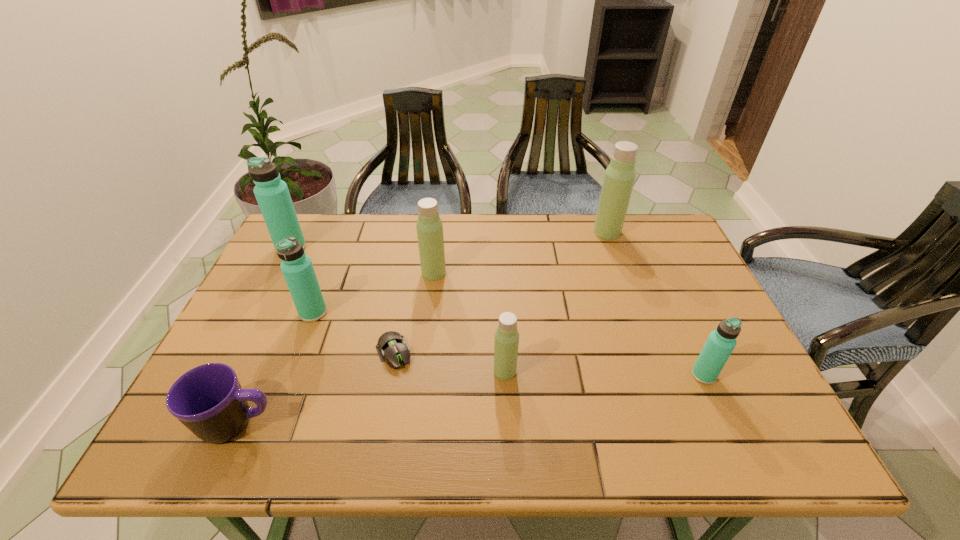
The image size is (960, 540). What are the coordinates of `the biggest light thermos bottle` in the screenshot? It's located at (619, 178).

Locate an element on the screen. This screenshot has height=540, width=960. the second object from right to left is located at coordinates 619,178.

You are a GUI agent. You are given a task and a screenshot of the screen. Output one action in this format:
    pyautogui.click(x=<x>, y=<y>)
    Task: Click on the leftmost thermos bottle
    This screenshot has height=540, width=960.
    Given the screenshot: What is the action you would take?
    pyautogui.click(x=272, y=194)

Locate an element on the screen. the leftmost aqua thermos bottle is located at coordinates (272, 194).

Image resolution: width=960 pixels, height=540 pixels. Find the location of `the fourth thermos bottle from right to left`. the fourth thermos bottle from right to left is located at coordinates (429, 226).

Locate an element on the screen. the third farthest object is located at coordinates (x=429, y=226).

The image size is (960, 540). In order to click on the third nearest thermos bottle in this screenshot , I will do `click(297, 268)`.

At what (x,y) coordinates should I click in order to perform the action: click on the second aqua thermos bottle from right to left. Please return your answer as a coordinate pair (x, y). This screenshot has height=540, width=960. Looking at the image, I should click on (297, 268).

You are a GUI agent. You are given a task and a screenshot of the screen. Output one action in this format:
    pyautogui.click(x=<x>, y=<y>)
    Task: Click on the second light thermos bottle from left to right
    
    Given the screenshot: What is the action you would take?
    pyautogui.click(x=506, y=343)

This screenshot has width=960, height=540. In order to click on the smallest light thermos bottle in this screenshot , I will do `click(506, 343)`.